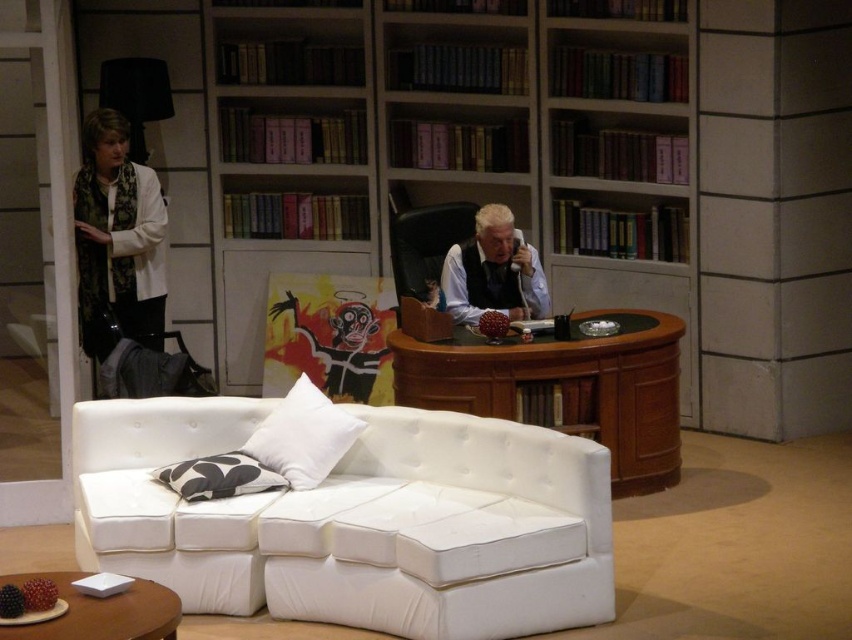
Question: Which is farther from the wooden desk at center?

Choices:
 (A) white leather couch at lower center
 (B) gray-patterned fabric pillow at lower center
 (C) white fabric pillow at center

Answer: (B)

Question: Can you confirm if wooden desk at center is bigger than black leather armchair at center?

Choices:
 (A) yes
 (B) no

Answer: (A)

Question: Does wooden desk at center appear on the left side of wooden round table at lower left?

Choices:
 (A) yes
 (B) no

Answer: (B)

Question: Does white leather vest at center have a lesser width compared to white fabric pillow at center?

Choices:
 (A) no
 (B) yes

Answer: (B)

Question: Which object is farther from the camera taking this photo?

Choices:
 (A) wooden round table at lower left
 (B) wooden bookcase at upper center
 (C) black leather armchair at center

Answer: (B)

Question: Which point is farther to the camera?

Choices:
 (A) wooden desk at center
 (B) black leather armchair at center

Answer: (B)